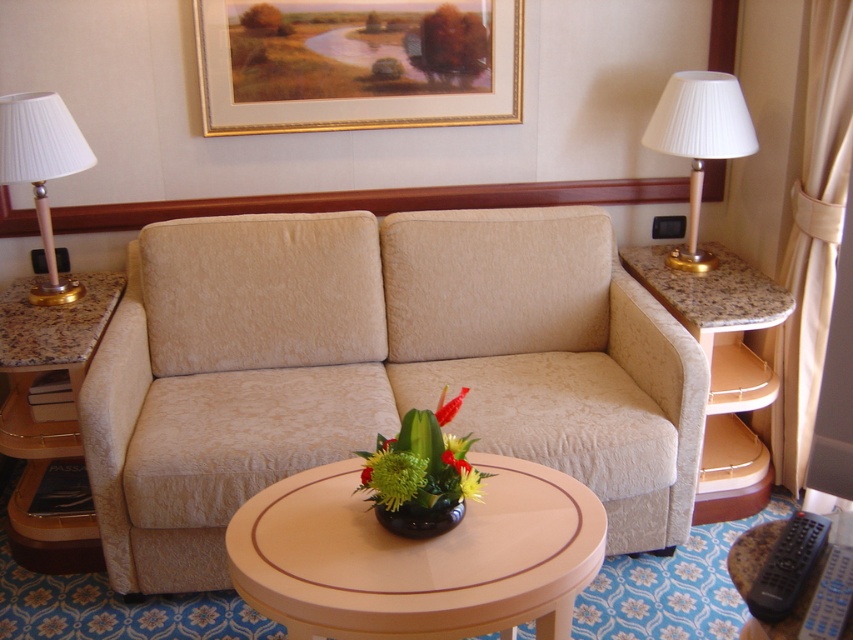
You are standing in the living space and want to place a small decorative item on the table that is closer to you. Which table should you choose between point (x=720, y=406) and point (x=688, y=113)?

Point (x=720, y=406) is further to the viewer than point (x=688, y=113), so you should choose the table at point (x=720, y=406) because it is closer to you.

You are a hotel guest who just arrived and wants to place a small vase on the wooden round table at center. However, you notice the green matte flower at center is already there. Can you move the flower to the right side table to make space?

The wooden round table at center is positioned on the right side of green matte flower at center, so moving the green matte flower at center to the right side table would place it next to the existing items there. This should free up space on the wooden round table at center for your vase.